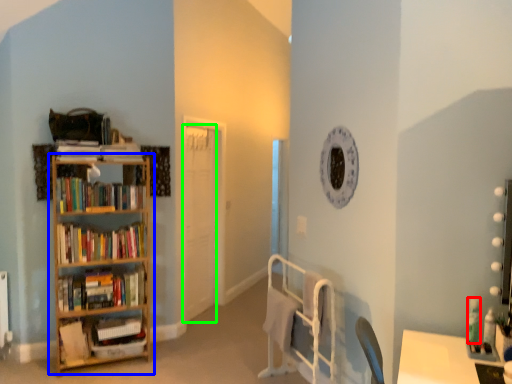
Question: Considering the real-world distances, which object is farthest from toiletry (highlighted by a red box)? shelf (highlighted by a blue box) or door (highlighted by a green box)?

Choices:
 (A) shelf
 (B) door

Answer: (B)